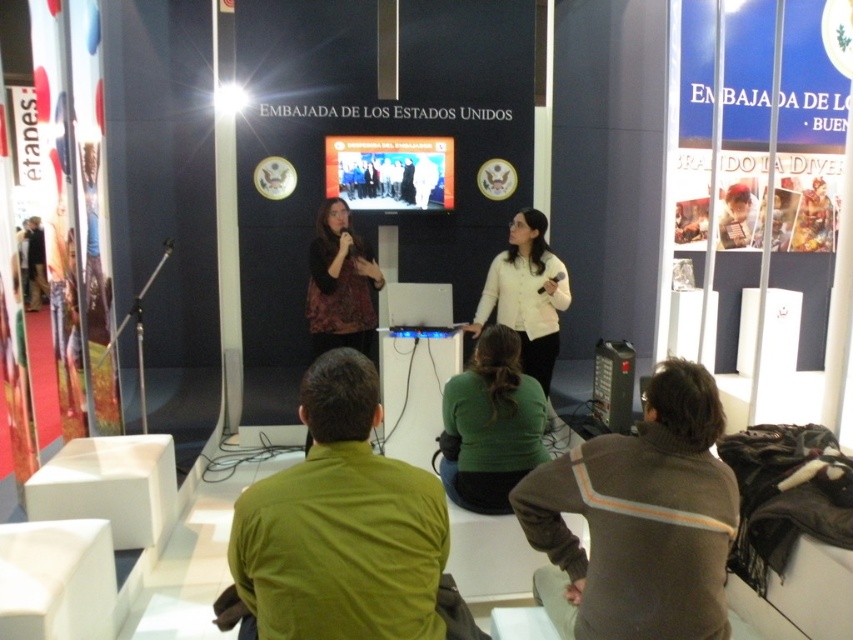
You are standing at the origin point of the coordinate system in the image. You want to move towards the brown sweater at lower right. What direction should you move in?

Since the brown sweater at lower right is located at coordinate point 0.814 on the x axis and 0.749 on the y axis, you should move towards the right and downward direction to reach it.

You are attending an event at the U.S. Embassy and notice two presenters on stage. One is wearing a green matte shirt at lower center and the other a patterned fabric shirt at center. Which presenter is shorter?

The green matte shirt at lower center is shorter than the patterned fabric shirt at center.